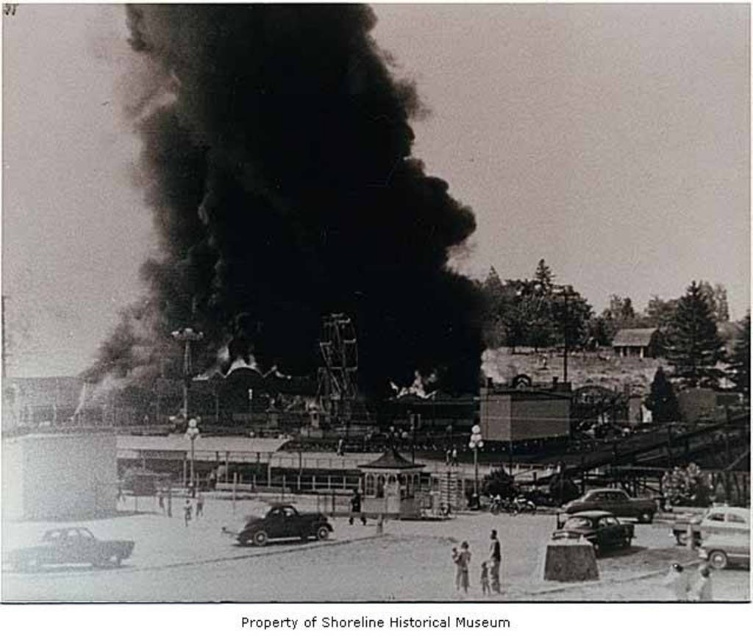
How far apart are shiny black car at center and shiny silver car at center?

The distance of shiny black car at center from shiny silver car at center is 64.13 feet.

Does point (305, 518) come behind point (617, 525)?

Yes.

Find the location of `shiny black car at center`. shiny black car at center is located at coordinates (279, 525).

Does shiny black car at lower left appear under shiny black car at center?

Yes.

Between shiny black car at lower left and shiny black car at center, which one appears on the right side from the viewer's perspective?

Positioned to the right is shiny black car at center.

Does point (41, 556) lie behind point (293, 515)?

That is False.

What are the coordinates of `shiny black car at lower left` in the screenshot? It's located at (69, 550).

Describe the element at coordinates (288, 198) in the screenshot. The image size is (753, 640). I see `black smoke at center` at that location.

How distant is black smoke at center from shiny silver car at center?

black smoke at center is 72.48 meters from shiny silver car at center.

Locate an element on the screen. This screenshot has width=753, height=640. black smoke at center is located at coordinates (288, 198).